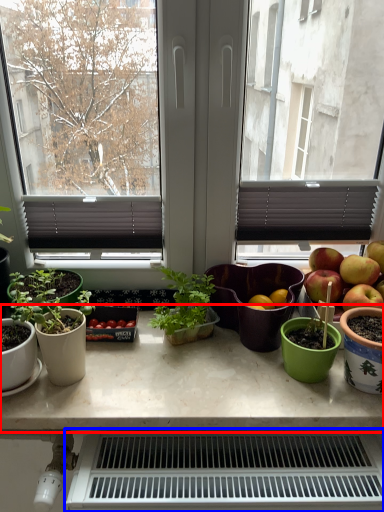
Question: Which object is closer to the camera taking this photo, table (highlighted by a red box) or appliance (highlighted by a blue box)?

Choices:
 (A) table
 (B) appliance

Answer: (B)